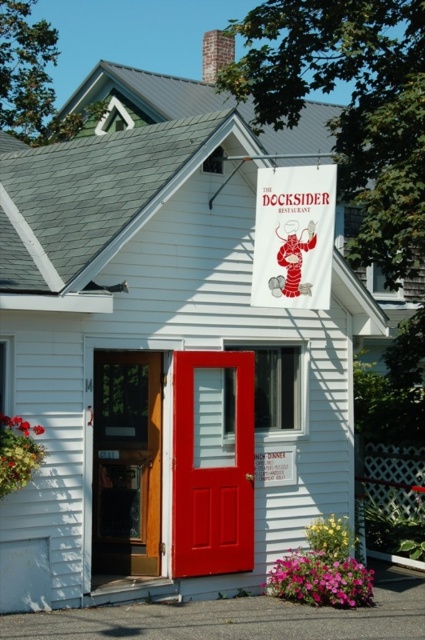
Measure the distance between matte red door at center and wooden door at center.

matte red door at center is 52.79 centimeters away from wooden door at center.

Based on the photo, is matte red door at center taller than wooden door at center?

Yes.

Image resolution: width=425 pixels, height=640 pixels. I want to click on matte red door at center, so tap(212, 465).

You are a GUI agent. You are given a task and a screenshot of the screen. Output one action in this format:
    pyautogui.click(x=<x>, y=<y>)
    Task: Click on the wooden door at center
    Image resolution: width=425 pixels, height=640 pixels.
    Given the screenshot: What is the action you would take?
    pyautogui.click(x=127, y=464)

What do you see at coordinates (127, 464) in the screenshot? The image size is (425, 640). I see `wooden door at center` at bounding box center [127, 464].

Locate an element on the screen. wooden door at center is located at coordinates (127, 464).

Does matte red door at center come behind white fabric sign at upper center?

Yes, it is.

Is matte red door at center wider than white fabric sign at upper center?

No.

Between point (252, 413) and point (311, 182), which one is positioned in front?

Positioned in front is point (311, 182).

Where is `matte red door at center`? This screenshot has height=640, width=425. matte red door at center is located at coordinates (212, 465).